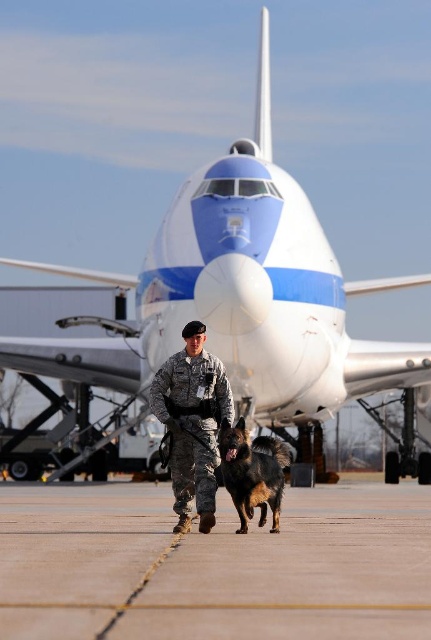
Does concrete tarmac at center have a smaller size compared to black fur dog at center?

No.

This screenshot has width=431, height=640. What do you see at coordinates (214, 566) in the screenshot?
I see `concrete tarmac at center` at bounding box center [214, 566].

The width and height of the screenshot is (431, 640). In order to click on concrete tarmac at center in this screenshot , I will do `click(214, 566)`.

Can you confirm if camouflage uniform at center is shorter than black fur dog at center?

In fact, camouflage uniform at center may be taller than black fur dog at center.

Measure the distance from camouflage uniform at center to black fur dog at center.

camouflage uniform at center and black fur dog at center are 11.11 inches apart from each other.

Who is more forward, [156,417] or [234,484]?

Point [234,484] is more forward.

In order to click on camouflage uniform at center in this screenshot , I will do `click(193, 422)`.

Does point (34, 609) lie in front of point (203, 435)?

Yes, it is.

The width and height of the screenshot is (431, 640). I want to click on concrete tarmac at center, so click(214, 566).